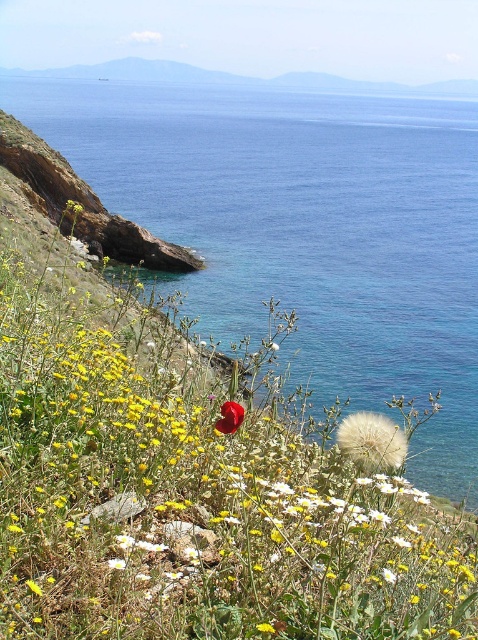
You are a photographer trying to capture the entire scene in one shot. Given that your camera can only focus on objects within a 100cm width, will the blue water at center and the white fluffy dandelion at center both fit within the frame?

The blue water at center is wider than the white fluffy dandelion at center. Since the camera can focus on objects within a 100cm width, both objects can fit as long as their combined width doesn

You are standing on the cliff overlooking the coastal landscape. You see the blue water at center and the bright red petal at center. Which one is higher in elevation?

The blue water at center is positioned over the bright red petal at center, so the blue water at center is higher in elevation.